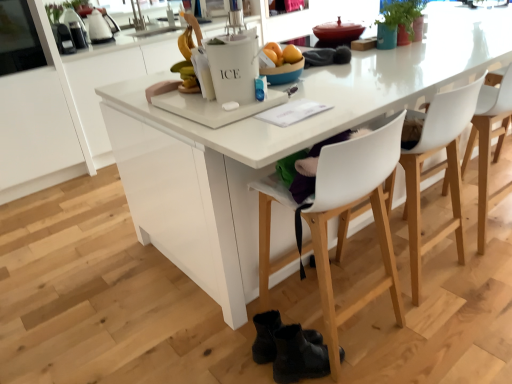
Question: Does black leather boots at lower center, which is the 1th footwear from front to back, have a lesser width compared to green matte plant at upper right?

Choices:
 (A) no
 (B) yes

Answer: (A)

Question: From the image's perspective, would you say black leather boots at lower center, which is the 1th footwear from front to back, is positioned over green matte plant at upper right?

Choices:
 (A) yes
 (B) no

Answer: (B)

Question: Does black leather boots at lower center, marked as the 2th footwear in a back-to-front arrangement, have a larger size compared to green matte plant at upper right?

Choices:
 (A) no
 (B) yes

Answer: (B)

Question: Could you tell me if black leather boots at lower center, marked as the 2th footwear in a back-to-front arrangement, is turned towards green matte plant at upper right?

Choices:
 (A) yes
 (B) no

Answer: (B)

Question: Is black leather boots at lower center, which is the 1th footwear from front to back, positioned with its back to green matte plant at upper right?

Choices:
 (A) no
 (B) yes

Answer: (A)

Question: From a real-world perspective, is white plastic chair at center, which is counted as the 3th chair, starting from the right, positioned above or below white plastic chair at center, which is counted as the second chair, starting from the right?

Choices:
 (A) below
 (B) above

Answer: (B)

Question: Visually, is white plastic chair at center, which is the 1th chair in left-to-right order, positioned to the left or to the right of white plastic chair at center, which is counted as the second chair, starting from the right?

Choices:
 (A) right
 (B) left

Answer: (B)

Question: Is white plastic chair at center, which is counted as the 3th chair, starting from the right, inside the boundaries of white plastic chair at center, which is counted as the second chair, starting from the right, or outside?

Choices:
 (A) inside
 (B) outside

Answer: (B)

Question: Considering the positions of point (264, 289) and point (442, 168), is point (264, 289) closer or farther from the camera than point (442, 168)?

Choices:
 (A) closer
 (B) farther

Answer: (A)

Question: From a real-world perspective, relative to white plastic chair at right, acting as the third chair starting from the left, is black leather boots at lower center, acting as the first footwear starting from the back, vertically above or below?

Choices:
 (A) below
 (B) above

Answer: (A)

Question: In terms of size, does black leather boots at lower center, acting as the first footwear starting from the back, appear bigger or smaller than white plastic chair at right, which is the first chair from right to left?

Choices:
 (A) big
 (B) small

Answer: (B)

Question: Is black leather boots at lower center, which is the 2th footwear from front to back, to the left or to the right of white plastic chair at right, which is the first chair from right to left, in the image?

Choices:
 (A) right
 (B) left

Answer: (B)

Question: Is black leather boots at lower center, which is the 2th footwear from front to back, wider or thinner than white plastic chair at right, which is the first chair from right to left?

Choices:
 (A) wide
 (B) thin

Answer: (B)

Question: In terms of width, does white plastic chair at right, acting as the third chair starting from the left, look wider or thinner when compared to green matte plant at upper right?

Choices:
 (A) thin
 (B) wide

Answer: (B)

Question: Is white plastic chair at right, acting as the third chair starting from the left, taller or shorter than green matte plant at upper right?

Choices:
 (A) tall
 (B) short

Answer: (A)